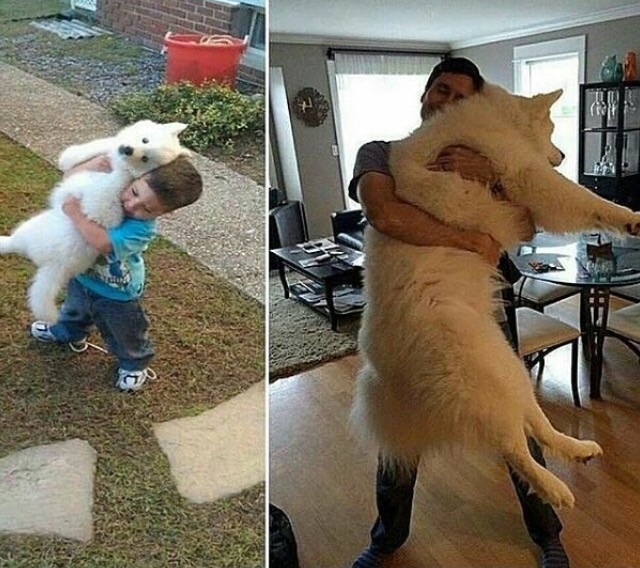
What are the coordinates of `three chair seats to sit in at dining table` in the screenshot? It's located at (536, 329), (547, 289), (630, 327).